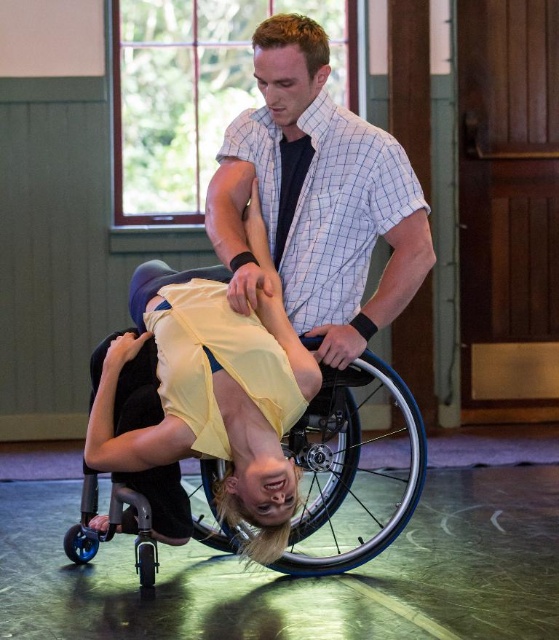
Does white checkered shirt at center have a lesser height compared to black plastic wheelchair at center?

No, white checkered shirt at center is not shorter than black plastic wheelchair at center.

Is white checkered shirt at center wider than black plastic wheelchair at center?

Incorrect, white checkered shirt at center's width does not surpass black plastic wheelchair at center's.

This screenshot has height=640, width=559. What do you see at coordinates (316, 196) in the screenshot?
I see `white checkered shirt at center` at bounding box center [316, 196].

Where is `white checkered shirt at center`? This screenshot has width=559, height=640. white checkered shirt at center is located at coordinates (316, 196).